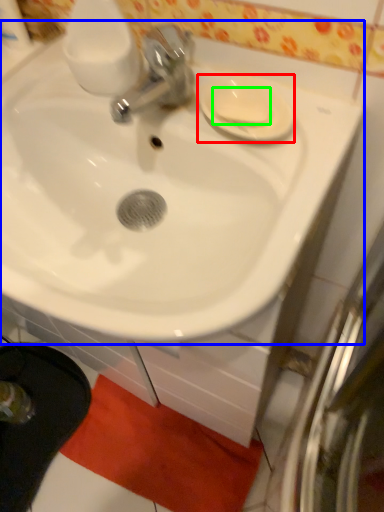
Question: Considering the real-world distances, which object is closest to saucer (highlighted by a red box)? sink (highlighted by a blue box) or soap (highlighted by a green box).

Choices:
 (A) sink
 (B) soap

Answer: (B)